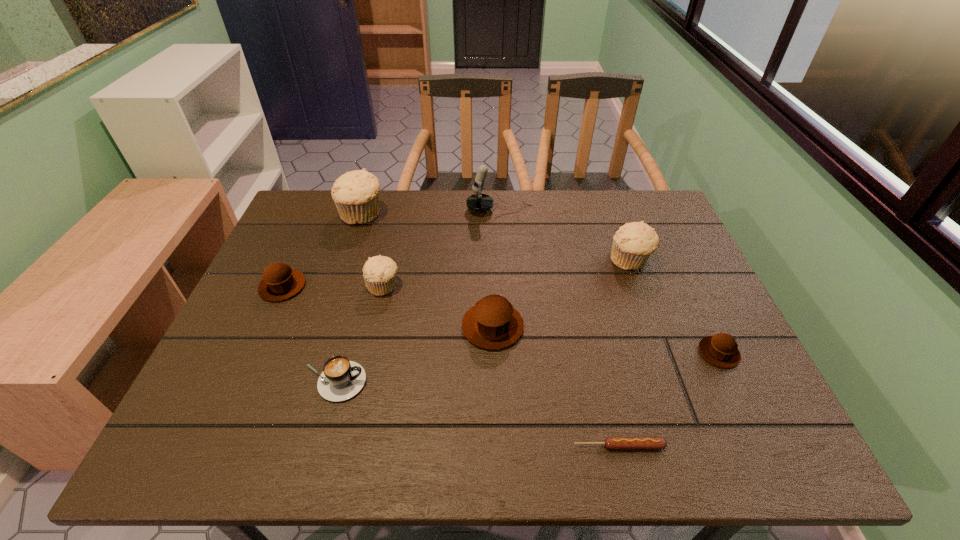
You are a GUI agent. You are given a task and a screenshot of the screen. Output one action in this format:
    pyautogui.click(x=<x>, y=<y>)
    Task: Click on the free spot located on the left of the fourth muffin from left to right
    
    Given the screenshot: What is the action you would take?
    pyautogui.click(x=297, y=327)

Identify the location of vacant area situated 0.190m on the front of the leftmost object. (247, 366).

Locate an element on the screen. This screenshot has height=540, width=960. vacant area situated with the handle on the side of the cappuccino is located at coordinates (495, 382).

At what (x,y) coordinates should I click in order to perform the action: click on free space located 0.400m on the left of the rightmost muffin. Please return your answer as a coordinate pair (x, y). Looking at the image, I should click on (525, 353).

I want to click on free spot located 0.180m on the left of the sausage, so click(x=480, y=446).

This screenshot has height=540, width=960. What are the coordinates of `microphone present at the far edge` in the screenshot? It's located at (479, 202).

I want to click on muffin at the far edge, so click(355, 194).

Find the location of a particular element. This screenshot has width=960, height=540. object positioned at the near edge is located at coordinates (610, 442).

Find the location of a particular element. The image size is (960, 540). object located at the far left corner is located at coordinates (355, 194).

The image size is (960, 540). I want to click on free space at the far edge, so click(x=608, y=202).